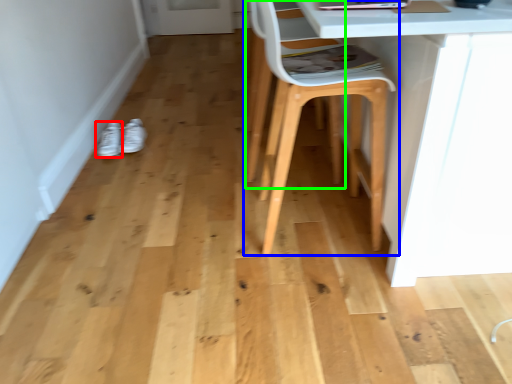
Question: Which is farther away from footwear (highlighted by a red box)? chair (highlighted by a blue box) or swivel chair (highlighted by a green box)?

Choices:
 (A) chair
 (B) swivel chair

Answer: (A)